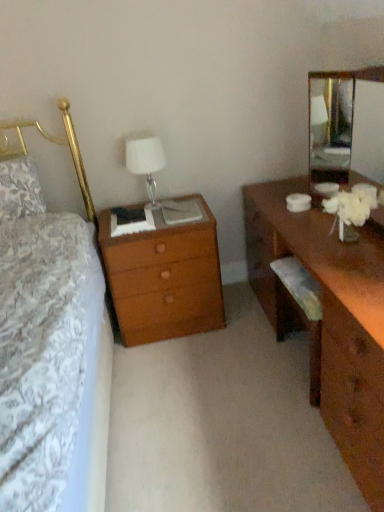
Where is `free spot to the left of clear glass mirror at upper right`? free spot to the left of clear glass mirror at upper right is located at coordinates (301, 224).